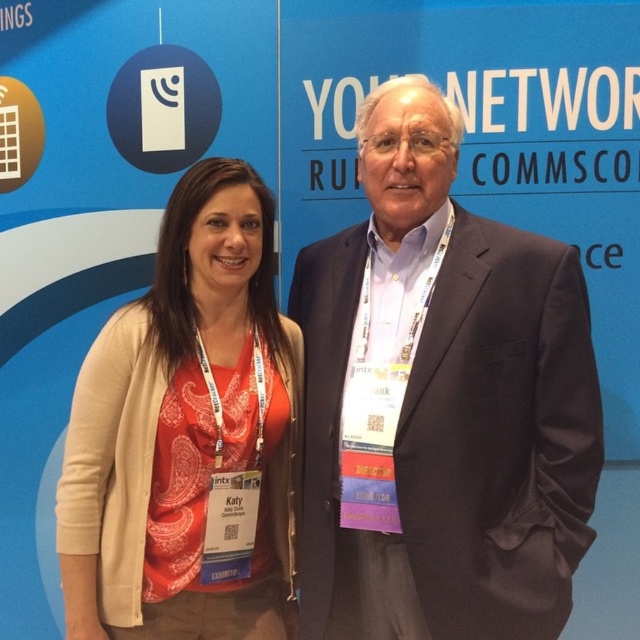
You are a photographer setting up for a group photo. You need to ensure that both the satin black suit at center and the matte orange shirt at center are fully visible in the frame. Based on their positions, which clothing item might require you to adjust the camera angle to accommodate its width?

The satin black suit at center might be wider than the matte orange shirt at center, so adjusting the camera angle to account for its width would ensure both are fully visible.